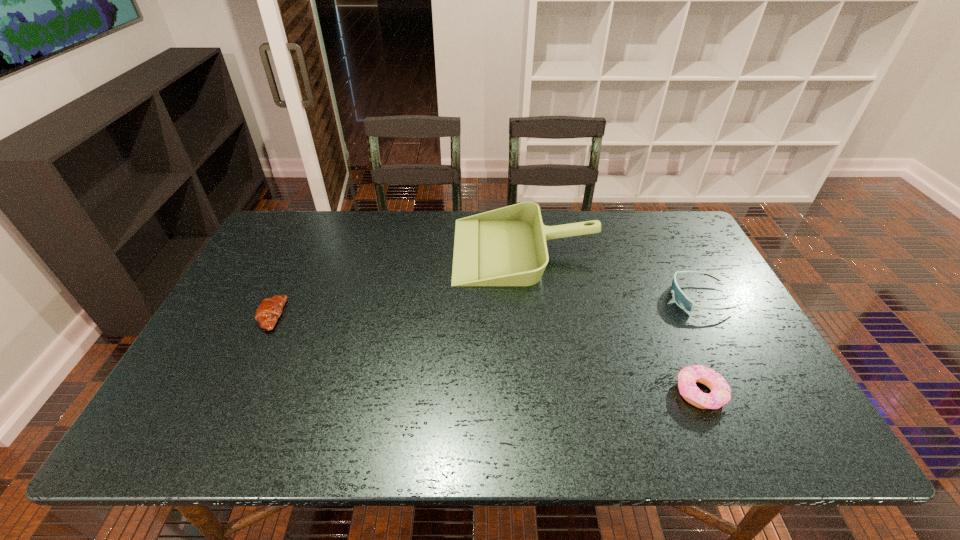
The height and width of the screenshot is (540, 960). I want to click on free space located on the front-facing side of the goggles, so click(648, 298).

I want to click on vacant space located 0.260m on the front of the leftmost object, so click(x=219, y=426).

Where is `vacant space located on the right of the nearest object`? vacant space located on the right of the nearest object is located at coordinates point(785,393).

Where is `object present at the far edge`? The width and height of the screenshot is (960, 540). object present at the far edge is located at coordinates (507, 246).

What are the coordinates of `object at the near edge` in the screenshot? It's located at (720, 394).

Identify the location of object that is at the left edge. (269, 310).

Locate an element on the screen. goggles at the right edge is located at coordinates (680, 298).

I want to click on doughnut that is positioned at the right edge, so click(720, 394).

You are a GUI agent. You are given a task and a screenshot of the screen. Output one action in this format:
    pyautogui.click(x=<x>, y=<y>)
    Task: Click on the object that is at the near right corner
    
    Given the screenshot: What is the action you would take?
    pyautogui.click(x=720, y=394)

The height and width of the screenshot is (540, 960). I want to click on vacant space at the far edge of the desktop, so click(468, 215).